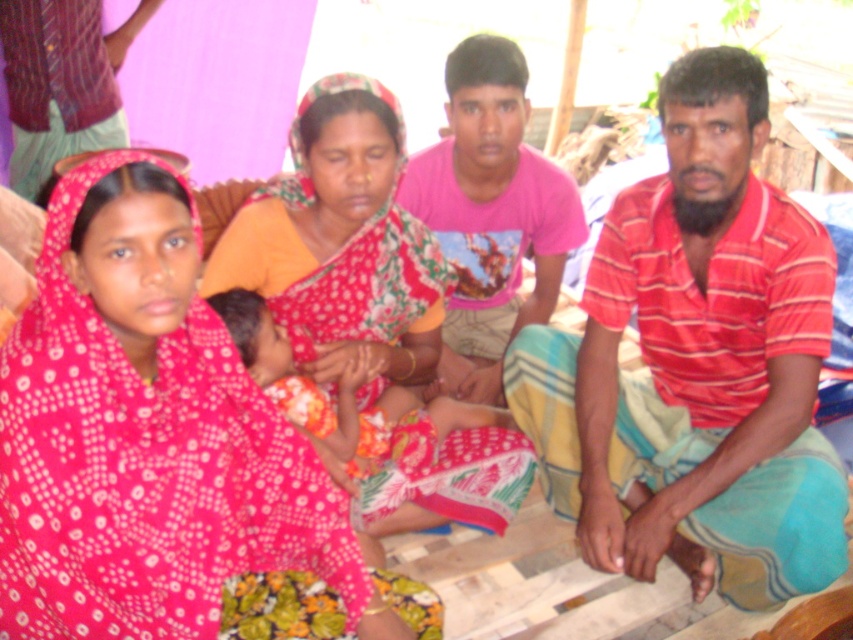
Question: Does red striped shirt at center appear under polka dot fabric sari at center?

Choices:
 (A) no
 (B) yes

Answer: (A)

Question: Estimate the real-world distances between objects in this image. Which object is farther from the red striped shirt at center?

Choices:
 (A) floral fabric sari at center
 (B) polka dot fabric sari at center
 (C) pink cotton shirt at center

Answer: (B)

Question: Does red striped shirt at center have a lesser width compared to floral fabric sari at center?

Choices:
 (A) no
 (B) yes

Answer: (B)

Question: Which point is farther to the camera?

Choices:
 (A) (495, 116)
 (B) (654, 496)
 (C) (225, 257)
 (D) (224, 445)

Answer: (A)

Question: Can you confirm if polka dot fabric sari at center is thinner than floral fabric sari at center?

Choices:
 (A) yes
 (B) no

Answer: (A)

Question: Which point appears farthest from the camera in this image?

Choices:
 (A) (454, 129)
 (B) (166, 410)
 (C) (799, 561)
 (D) (329, 164)

Answer: (A)